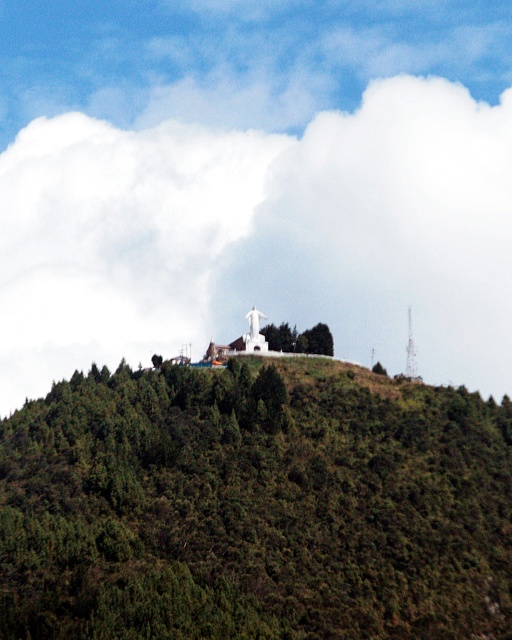
Question: Which of the following is the closest to the observer?

Choices:
 (A) (326, 522)
 (B) (18, 209)

Answer: (A)

Question: Is green textured hillside at center bigger than white fluffy cloud at upper center?

Choices:
 (A) yes
 (B) no

Answer: (B)

Question: Which point is closer to the camera?

Choices:
 (A) (189, 492)
 (B) (27, 188)

Answer: (A)

Question: Is green textured hillside at center to the left of white fluffy cloud at upper center from the viewer's perspective?

Choices:
 (A) yes
 (B) no

Answer: (A)

Question: Is green textured hillside at center thinner than white fluffy cloud at upper center?

Choices:
 (A) no
 (B) yes

Answer: (B)

Question: Which point is closer to the camera taking this photo?

Choices:
 (A) (230, 230)
 (B) (332, 628)

Answer: (B)